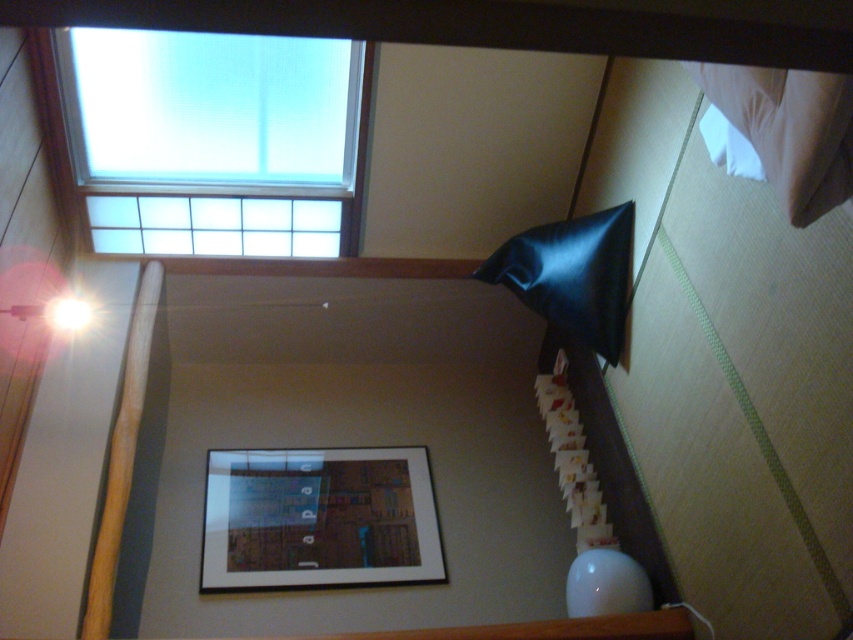
Question: Which of the following is the closest to the observer?

Choices:
 (A) wooden framed picture at center
 (B) black leather pillow at upper right
 (C) transparent glass window at upper left
 (D) wooden beam at left

Answer: (D)

Question: Does wooden framed picture at center come behind white paper at center?

Choices:
 (A) yes
 (B) no

Answer: (B)

Question: Does wooden framed picture at center appear over white paper at center?

Choices:
 (A) no
 (B) yes

Answer: (A)

Question: Can you confirm if wooden framed picture at center is positioned to the left of wooden beam at left?

Choices:
 (A) no
 (B) yes

Answer: (A)

Question: Among these objects, which one is farthest from the camera?

Choices:
 (A) white paper at center
 (B) transparent glass window at upper left
 (C) wooden beam at left
 (D) white soft pillow at upper right

Answer: (A)

Question: Which of these objects is positioned closest to the white soft pillow at upper right?

Choices:
 (A) white paper at center
 (B) black leather pillow at upper right

Answer: (B)